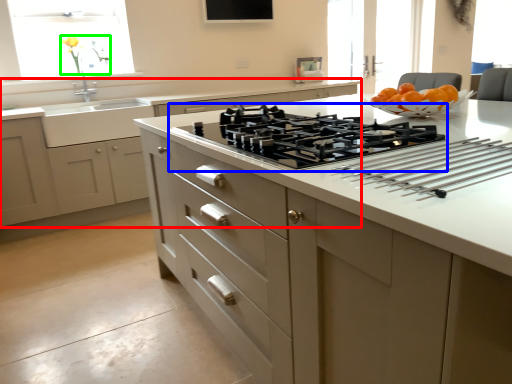
Question: Which object is positioned closest to cabinetry (highlighted by a red box)? Select from gas stove (highlighted by a blue box) and flower (highlighted by a green box).

Choices:
 (A) gas stove
 (B) flower

Answer: (B)